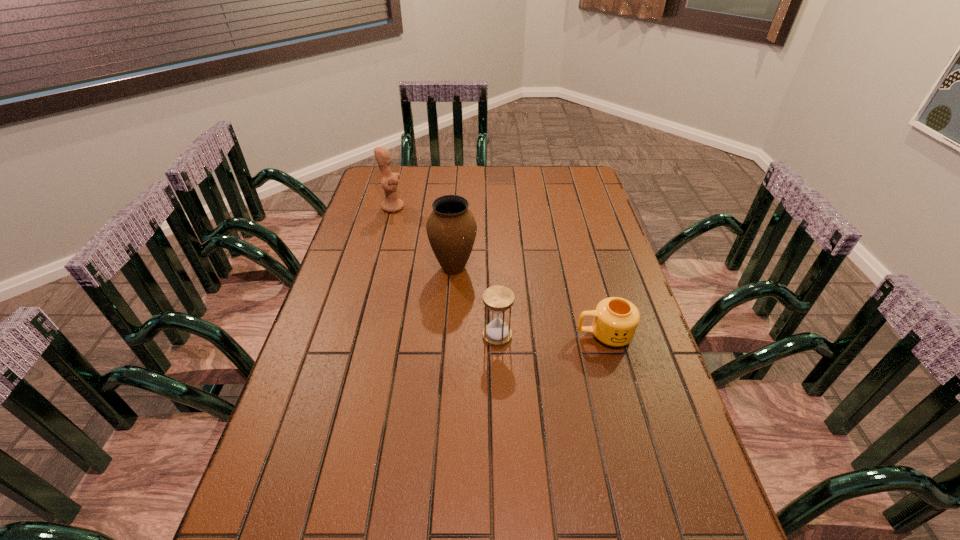
Identify the location of vacant area situated on the back of the second object from right to left. (494, 259).

At what (x,y) coordinates should I click in order to perform the action: click on vacant region located on the handle side of the rightmost object. Please return your answer as a coordinate pair (x, y). Looking at the image, I should click on (532, 335).

This screenshot has height=540, width=960. What are the coordinates of `vacant position located 0.140m on the handle side of the rightmost object` in the screenshot? It's located at (525, 335).

At what (x,y) coordinates should I click in order to perform the action: click on vacant region located on the handle side of the rightmost object. Please return your answer as a coordinate pair (x, y). The width and height of the screenshot is (960, 540). Looking at the image, I should click on (437, 335).

This screenshot has height=540, width=960. I want to click on object located at the left edge, so click(389, 181).

Locate an element on the screen. The height and width of the screenshot is (540, 960). object that is at the right edge is located at coordinates (615, 322).

Locate an element on the screen. The image size is (960, 540). vacant space at the far edge of the desktop is located at coordinates (410, 190).

Where is `vacant space at the left edge of the desktop`? The width and height of the screenshot is (960, 540). vacant space at the left edge of the desktop is located at coordinates (337, 422).

Where is `free space at the right edge of the desktop`? free space at the right edge of the desktop is located at coordinates (633, 389).

Locate an element on the screen. vacant space at the far left corner is located at coordinates (402, 187).